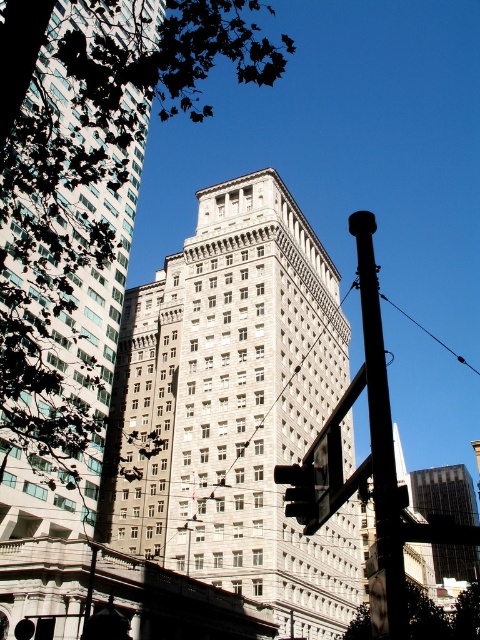
Is green leafy tree at upper left below matte black traffic light at center?

Incorrect, green leafy tree at upper left is not positioned below matte black traffic light at center.

Is green leafy tree at upper left closer to the viewer compared to matte black traffic light at center?

Yes.

You are a GUI agent. You are given a task and a screenshot of the screen. Output one action in this format:
    pyautogui.click(x=<x>, y=<y>)
    Task: Click on the green leafy tree at upper left
    
    Given the screenshot: What is the action you would take?
    pyautogui.click(x=86, y=179)

The image size is (480, 640). What are the coordinates of `green leafy tree at upper left` in the screenshot? It's located at (86, 179).

Who is more forward, [361,301] or [476,550]?

Point [361,301] is in front.

Can you confirm if metallic pole at center is positioned to the right of gray concrete skyscraper at center?

Incorrect, metallic pole at center is not on the right side of gray concrete skyscraper at center.

This screenshot has height=640, width=480. I want to click on metallic pole at center, so click(x=380, y=428).

Between point (437, 624) and point (289, 474), which one is positioned in front?

Point (289, 474) is in front.

Which is more to the right, green leafy tree at lower right or matte black traffic light at center?

green leafy tree at lower right is more to the right.

What are the coordinates of `green leafy tree at lower right` in the screenshot? It's located at (443, 616).